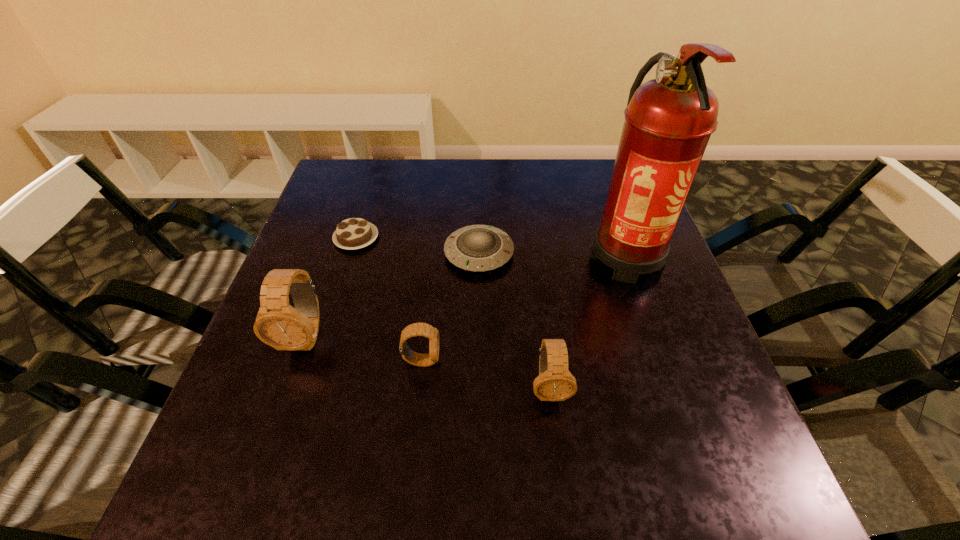
The height and width of the screenshot is (540, 960). Find the location of `free spot located 0.070m on the face of the tallest watch`. free spot located 0.070m on the face of the tallest watch is located at coordinates [286, 395].

Where is `vacant point located on the face of the second watch from right to left`? vacant point located on the face of the second watch from right to left is located at coordinates (575, 361).

Find the location of a particular element. This screenshot has width=960, height=540. free location located 0.050m on the face of the second tallest watch is located at coordinates (555, 436).

Image resolution: width=960 pixels, height=540 pixels. I want to click on vacant space situated 0.050m on the front-facing side of the rightmost object, so click(647, 316).

Where is `free space located 0.110m on the right of the saucer`? free space located 0.110m on the right of the saucer is located at coordinates (559, 253).

In order to click on vacant region located on the back of the shortest object in this screenshot , I will do `click(366, 206)`.

Identify the location of object at the near edge. click(x=555, y=382).

The image size is (960, 540). What are the coordinates of `watch situated at the left edge` in the screenshot? It's located at (279, 325).

You are a GUI agent. You are given a task and a screenshot of the screen. Output one action in this format:
    pyautogui.click(x=<x>, y=<y>)
    Task: Click on the chocolate cake that is at the left edge
    The width and height of the screenshot is (960, 540).
    Given the screenshot: What is the action you would take?
    pyautogui.click(x=354, y=233)

Locate an element on the screen. The width and height of the screenshot is (960, 540). object at the right edge is located at coordinates (669, 120).